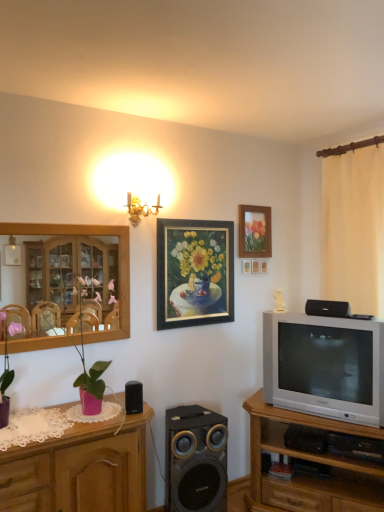
Question: Is wooden tv stand at right, acting as the 1th cabinetry starting from the right, to the left or to the right of black matte speaker at lower center, placed as the second speaker when sorted from right to left, in the image?

Choices:
 (A) left
 (B) right

Answer: (B)

Question: Is point (347, 431) positioned closer to the camera than point (203, 482)?

Choices:
 (A) farther
 (B) closer

Answer: (B)

Question: Which object is positioned farthest from the wooden cabinet at left?

Choices:
 (A) matte purple pot at left, the 1th plant when ordered from left to right
 (B) black matte speaker at lower center, placed as the second speaker when sorted from right to left
 (C) wooden tv stand at right, acting as the 1th cabinetry starting from the right
 (D) gold-framed painting at center, which appears as the first picture frame when viewed from the left
 (E) white sheer curtain at right

Answer: (E)

Question: Considering the real-world distances, which object is farthest from the pink matte vase at left, placed as the first plant when sorted from right to left?

Choices:
 (A) gold-framed painting at center, which appears as the first picture frame when viewed from the left
 (B) wooden picture frame at upper right, which is counted as the first picture frame, starting from the right
 (C) wooden cabinet at left
 (D) wooden tv stand at right, the 2th cabinetry from the left
 (E) pink wood cabinet at left, the second cabinetry positioned from the right

Answer: (B)